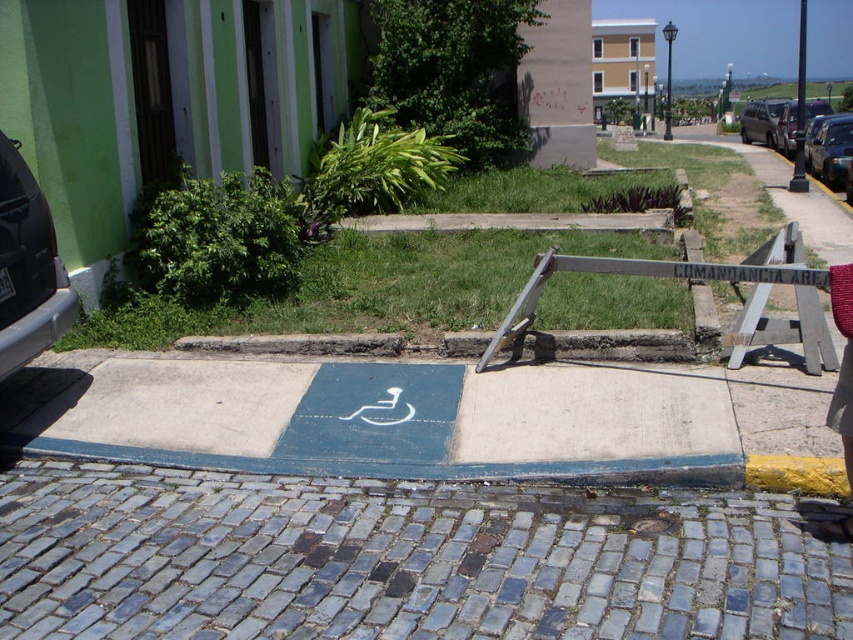
Question: Can you confirm if wooden sign at center is positioned to the left of metallic silver suv at upper right?

Choices:
 (A) no
 (B) yes

Answer: (B)

Question: Does metallic gray car at left lie in front of shiny black car at right?

Choices:
 (A) yes
 (B) no

Answer: (A)

Question: Which object is positioned farthest from the shiny black car at right?

Choices:
 (A) metallic gray car at left
 (B) wooden sign at center

Answer: (A)

Question: Observing the image, what is the correct spatial positioning of shiny black car at right in reference to metallic silver car at right?

Choices:
 (A) right
 (B) left

Answer: (B)

Question: Which point is farther from the camera taking this photo?

Choices:
 (A) (817, 148)
 (B) (762, 108)
 (C) (805, 122)

Answer: (B)

Question: Which point is farther to the camera?

Choices:
 (A) (805, 563)
 (B) (762, 140)

Answer: (B)